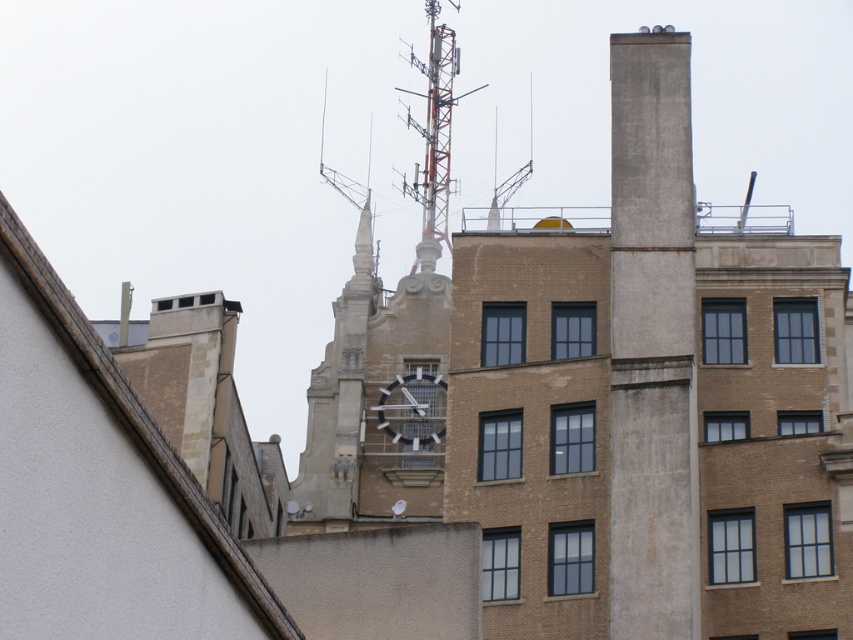
Does orange metallic antenna at upper center come in front of metallic gray clock at center?

No, orange metallic antenna at upper center is further to the viewer.

Is point (448, 132) closer to camera compared to point (415, 419)?

No, (448, 132) is further to viewer.

Where is `orange metallic antenna at upper center`? This screenshot has width=853, height=640. orange metallic antenna at upper center is located at coordinates (434, 124).

Which of these two, concrete chimney at right or metallic gray clock at center, stands taller?

concrete chimney at right is taller.

Is concrete chimney at right thinner than metallic gray clock at center?

Incorrect, concrete chimney at right's width is not less than metallic gray clock at center's.

Is point (685, 593) closer to viewer compared to point (427, 445)?

That is True.

The image size is (853, 640). I want to click on concrete chimney at right, so click(653, 342).

Can you confirm if concrete chimney at right is positioned to the right of orange metallic antenna at upper center?

Correct, you'll find concrete chimney at right to the right of orange metallic antenna at upper center.

Image resolution: width=853 pixels, height=640 pixels. Describe the element at coordinates (653, 342) in the screenshot. I see `concrete chimney at right` at that location.

Does point (647, 433) lie behind point (456, 58)?

No, it is not.

Locate an element on the screen. The height and width of the screenshot is (640, 853). concrete chimney at right is located at coordinates (653, 342).